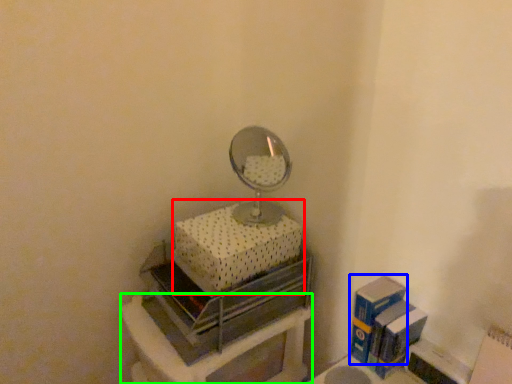
Question: Which is farther away from box (highlighted by a red box)? box (highlighted by a blue box) or furniture (highlighted by a green box)?

Choices:
 (A) box
 (B) furniture

Answer: (A)